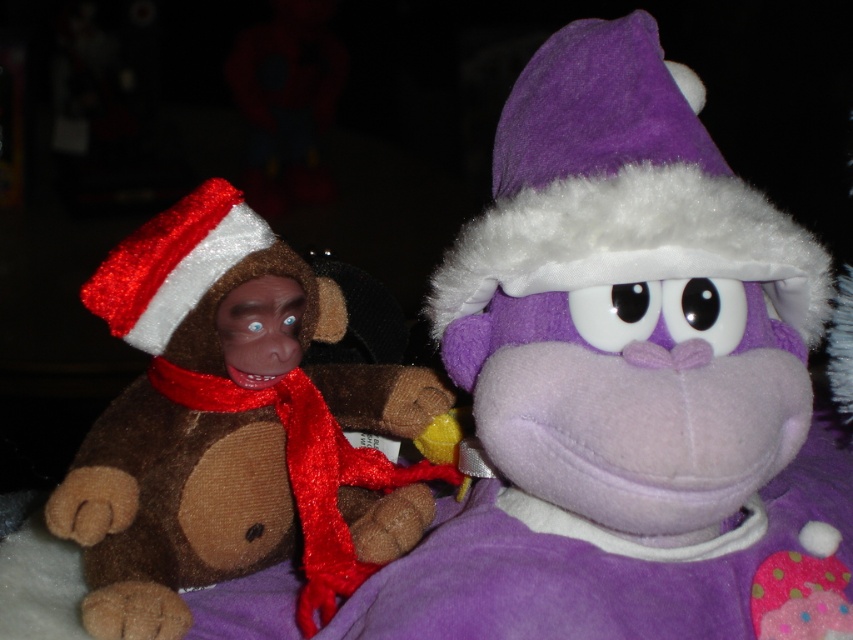
You are a child trying to decide which toy to hug first. The purple plush monkey at center is in front of you, and the red satin scarf at left is nearby. Which toy is wider so that it can give a bigger hug?

The purple plush monkey at center is wider than the red satin scarf at left, so it can give a bigger hug.

You are a child trying to find the red satin scarf at left in the image. You see the purple felt santa hat at upper center. Which object is higher in the image?

The purple felt santa hat at upper center is higher in the image than the red satin scarf at left.

You are a gift wrapper trying to decide which item to place under the Christmas tree. The purple felt santa hat at upper center and the red satin scarf at left are both options. Based on their sizes, which one would take up more space on the shelf?

The purple felt santa hat at upper center has a larger size compared to the red satin scarf at left, so it would take up more space on the shelf.